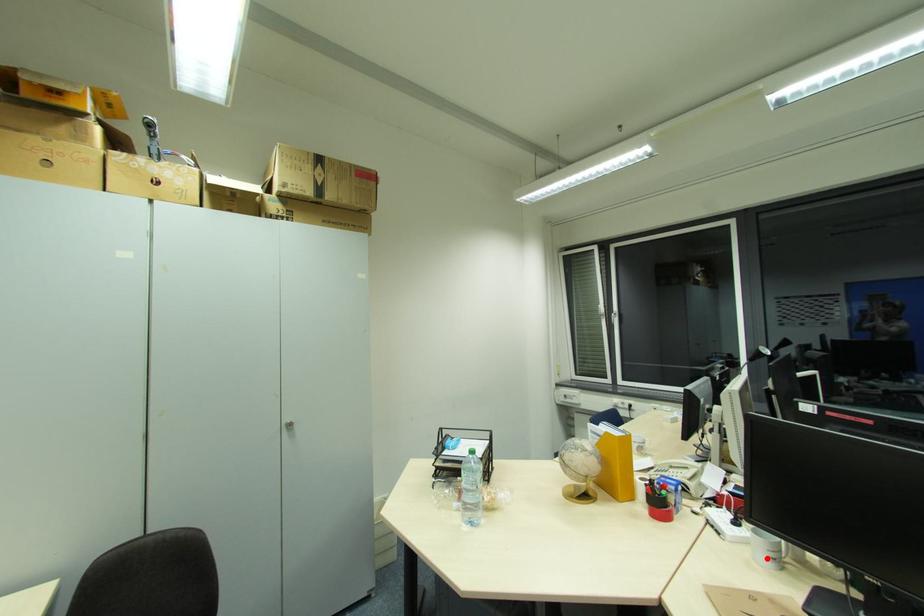
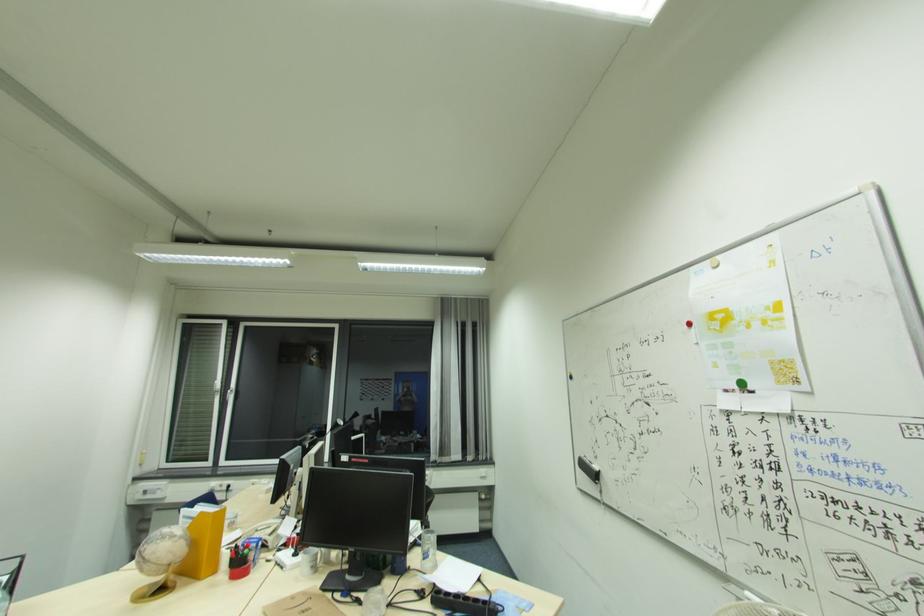
Find the pixel in the second image that matches the highlighted location in the first image.

(310, 570)